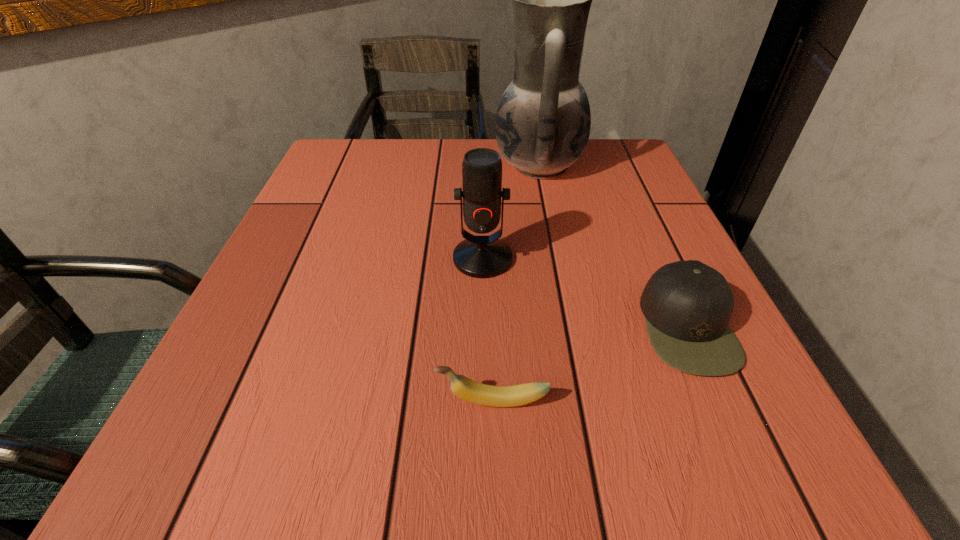
This screenshot has height=540, width=960. In order to click on vacant space located on the front-facing side of the farthest object in this screenshot , I will do `click(440, 166)`.

Identify the location of vacant space located on the side of the microphone with the red ring. Image resolution: width=960 pixels, height=540 pixels. pyautogui.click(x=484, y=487).

Where is `vacant space located on the brim of the rightmost object`? This screenshot has height=540, width=960. vacant space located on the brim of the rightmost object is located at coordinates (535, 327).

You are a GUI agent. You are given a task and a screenshot of the screen. Output one action in this format:
    pyautogui.click(x=<x>, y=<y>)
    Task: Click on the vacant space located on the brim of the rightmost object
    This screenshot has width=960, height=540.
    Given the screenshot: What is the action you would take?
    (612, 327)

The image size is (960, 540). What are the coordinates of `vacant space located 0.330m on the brim of the rightmost object` in the screenshot? It's located at (431, 327).

The height and width of the screenshot is (540, 960). I want to click on free region located 0.290m at the stem of the nearest object, so click(220, 401).

The width and height of the screenshot is (960, 540). Find the location of `vacant space located at the stem of the nearest object`. vacant space located at the stem of the nearest object is located at coordinates (273, 401).

The height and width of the screenshot is (540, 960). In order to click on vacant region located 0.310m at the stem of the nearest object in this screenshot , I will do `click(205, 401)`.

Image resolution: width=960 pixels, height=540 pixels. I want to click on object that is at the far edge, so click(x=543, y=120).

Locate an element on the screen. The image size is (960, 540). pitcher present at the right edge is located at coordinates (543, 120).